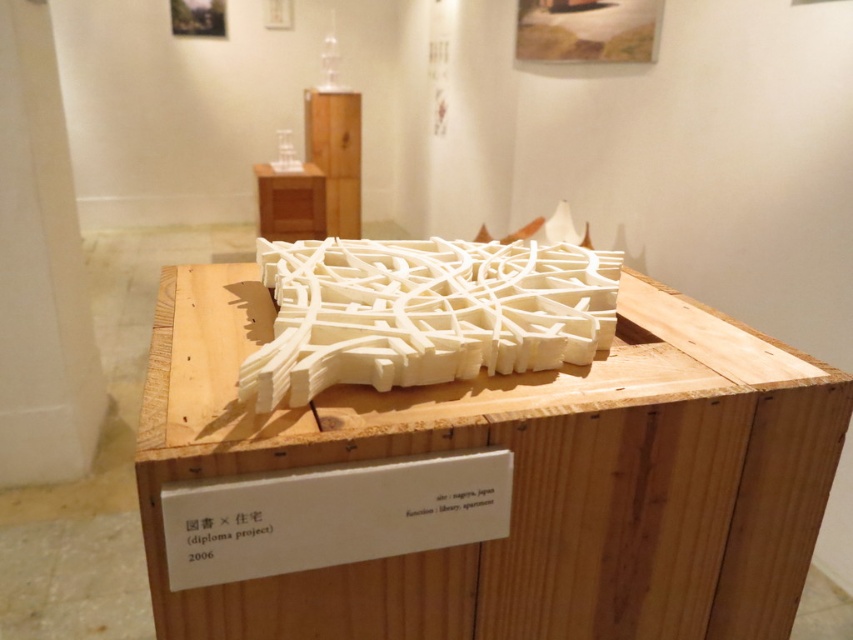
Question: In this image, where is white wood crate at center located relative to white matte maze at center?

Choices:
 (A) below
 (B) above

Answer: (A)

Question: Can you confirm if white wood crate at center is positioned to the left of white matte maze at center?

Choices:
 (A) no
 (B) yes

Answer: (A)

Question: Which object appears closest to the camera in this image?

Choices:
 (A) white wood crate at center
 (B) white matte maze at center

Answer: (A)

Question: Can you confirm if white wood crate at center is positioned above white matte maze at center?

Choices:
 (A) no
 (B) yes

Answer: (A)